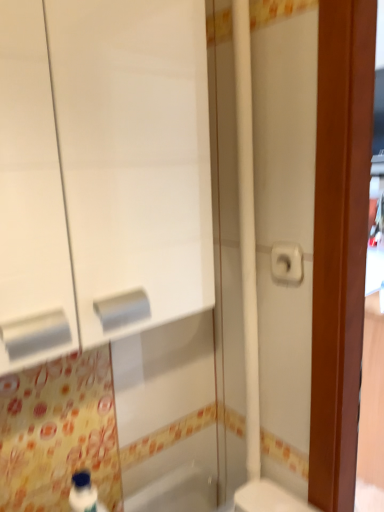
This screenshot has width=384, height=512. What do you see at coordinates (177, 490) in the screenshot?
I see `white glossy bathtub at lower center` at bounding box center [177, 490].

What do you see at coordinates (287, 263) in the screenshot? This screenshot has width=384, height=512. I see `white matte toilet paper at right` at bounding box center [287, 263].

Image resolution: width=384 pixels, height=512 pixels. Describe the element at coordinates (268, 498) in the screenshot. I see `white glossy toilet at lower right` at that location.

Locate an element on the screen. The width and height of the screenshot is (384, 512). white glossy bathtub at lower center is located at coordinates (177, 490).

Does white glossy bathtub at lower center turn towards white matte cabinet at left?

No, white glossy bathtub at lower center is not aimed at white matte cabinet at left.

From the image's perspective, is white glossy bathtub at lower center on top of white matte cabinet at left?

No.

Does white glossy bathtub at lower center touch white matte cabinet at left?

No, white glossy bathtub at lower center is not next to white matte cabinet at left.

Would you say white glossy bathtub at lower center is outside white matte cabinet at left?

Yes, white glossy bathtub at lower center is not within white matte cabinet at left.

Is white matte cabinet at left positioned with its back to white glossy bathtub at lower center?

No, white matte cabinet at left's orientation is not away from white glossy bathtub at lower center.

Does white matte cabinet at left have a smaller size compared to white glossy bathtub at lower center?

No.

Considering the positions of objects white matte cabinet at left and white glossy bathtub at lower center in the image provided, who is more to the right, white matte cabinet at left or white glossy bathtub at lower center?

Positioned to the right is white glossy bathtub at lower center.

Which of these two, white matte cabinet at left or white glossy bathtub at lower center, is thinner?

white glossy bathtub at lower center is thinner.

Is the position of white glossy toilet at lower right more distant than that of white matte cabinet at left?

Yes, it is behind white matte cabinet at left.

Which is more to the right, white glossy toilet at lower right or white matte cabinet at left?

white glossy toilet at lower right.

Based on their sizes in the image, would you say white glossy toilet at lower right is bigger or smaller than white matte cabinet at left?

Clearly, white glossy toilet at lower right is smaller in size than white matte cabinet at left.

Considering the sizes of white glossy bathtub at lower center and white matte toilet paper at right in the image, is white glossy bathtub at lower center taller or shorter than white matte toilet paper at right?

Considering their sizes, white glossy bathtub at lower center has more height than white matte toilet paper at right.

Would you say white glossy bathtub at lower center is to the left or to the right of white matte toilet paper at right in the picture?

Clearly, white glossy bathtub at lower center is on the left of white matte toilet paper at right in the image.

Is white glossy bathtub at lower center not close to white matte toilet paper at right?

No, there isn't a large distance between white glossy bathtub at lower center and white matte toilet paper at right.

Is white glossy bathtub at lower center turned away from white matte toilet paper at right?

white glossy bathtub at lower center is not turned away from white matte toilet paper at right.

Between white matte cabinet at left and white glossy toilet at lower right, which one appears on the right side from the viewer's perspective?

white glossy toilet at lower right is more to the right.

How far apart are white matte cabinet at left and white glossy toilet at lower right?

white matte cabinet at left is 27.61 inches away from white glossy toilet at lower right.

In terms of size, does white matte cabinet at left appear bigger or smaller than white glossy toilet at lower right?

white matte cabinet at left is bigger than white glossy toilet at lower right.

Which is closer to the camera, (36,354) or (240,494)?

The point (36,354) is closer to the camera.

From the image's perspective, which one is positioned lower, white matte toilet paper at right or white matte cabinet at left?

From the image's view, white matte toilet paper at right is below.

Relative to white matte cabinet at left, is white matte toilet paper at right in front or behind?

white matte toilet paper at right is behind white matte cabinet at left.

How far apart are white matte toilet paper at right and white matte cabinet at left?

white matte toilet paper at right is 15.22 inches away from white matte cabinet at left.

Can you see white matte toilet paper at right touching white matte cabinet at left?

There is a gap between white matte toilet paper at right and white matte cabinet at left.

Is white matte toilet paper at right looking in the opposite direction of white glossy bathtub at lower center?

No, white matte toilet paper at right's orientation is not away from white glossy bathtub at lower center.

Which of these two, white matte toilet paper at right or white glossy bathtub at lower center, is smaller?

white matte toilet paper at right is smaller.

Is white matte toilet paper at right shorter than white glossy bathtub at lower center?

Correct, white matte toilet paper at right is not as tall as white glossy bathtub at lower center.

From the image's perspective, is white matte toilet paper at right located above white glossy bathtub at lower center?

Yes.

The width and height of the screenshot is (384, 512). I want to click on bath below the white matte cabinet at left (from the image's perspective), so click(177, 490).

Where is `medicine cabinet above the white glossy bathtub at lower center (from a real-world perspective)`? medicine cabinet above the white glossy bathtub at lower center (from a real-world perspective) is located at coordinates [101, 172].

Estimate the real-world distances between objects in this image. Which object is further from white matte cabinet at left, white matte toilet paper at right or white glossy toilet at lower right?

white glossy toilet at lower right.

Which object lies nearer to the anchor point white glossy toilet at lower right, white glossy bathtub at lower center or white matte cabinet at left?

white glossy bathtub at lower center.

Looking at this image, considering their positions, is white glossy bathtub at lower center positioned closer to white matte toilet paper at right than white matte cabinet at left?

white matte cabinet at left lies closer to white matte toilet paper at right than the other object.

Which object lies further to the anchor point white matte cabinet at left, white glossy bathtub at lower center or white matte toilet paper at right?

Based on the image, white glossy bathtub at lower center appears to be further to white matte cabinet at left.

Estimate the real-world distances between objects in this image. Which object is further from white glossy bathtub at lower center, white glossy toilet at lower right or white matte toilet paper at right?

white matte toilet paper at right is positioned further to the anchor white glossy bathtub at lower center.

Based on their spatial positions, is white matte cabinet at left or white glossy bathtub at lower center further from white matte toilet paper at right?

The object further to white matte toilet paper at right is white glossy bathtub at lower center.

From the image, which object appears to be farther from white glossy toilet at lower right, white matte cabinet at left or white matte toilet paper at right?

white matte cabinet at left is further to white glossy toilet at lower right.

From the picture: When comparing their distances from white matte cabinet at left, does white glossy toilet at lower right or white glossy bathtub at lower center seem further?

white glossy bathtub at lower center is further to white matte cabinet at left.

The height and width of the screenshot is (512, 384). I want to click on toilet paper that lies between white matte cabinet at left and white glossy bathtub at lower center from top to bottom, so click(287, 263).

At what (x,y) coordinates should I click in order to perform the action: click on bath that lies between white matte cabinet at left and white glossy toilet at lower right from top to bottom. Please return your answer as a coordinate pair (x, y). This screenshot has height=512, width=384. Looking at the image, I should click on (177, 490).

What are the coordinates of `bath between white matte toilet paper at right and white glossy toilet at lower right from top to bottom` in the screenshot? It's located at (177, 490).

Find the location of a particular element. toilet paper between white matte cabinet at left and white glossy toilet at lower right in the vertical direction is located at coordinates (287, 263).